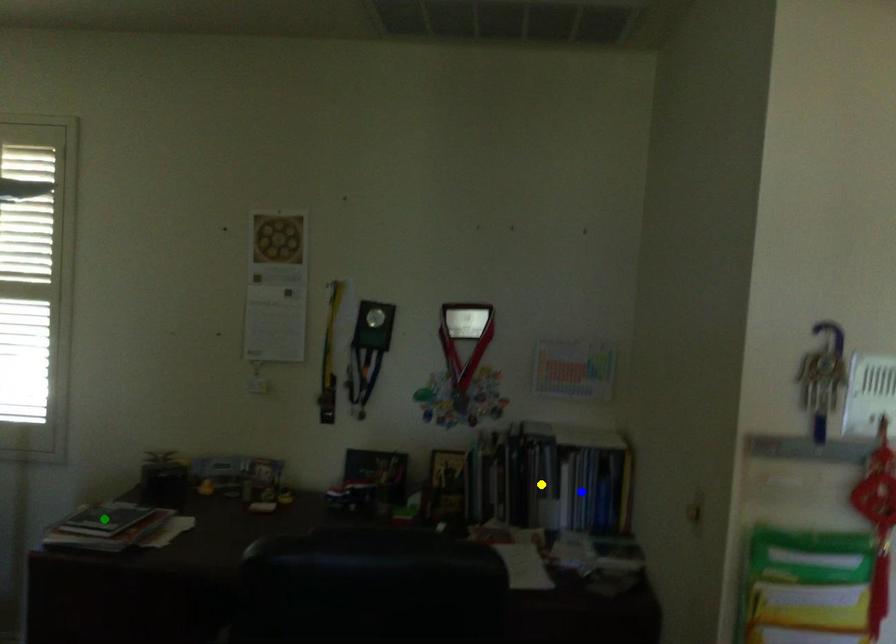
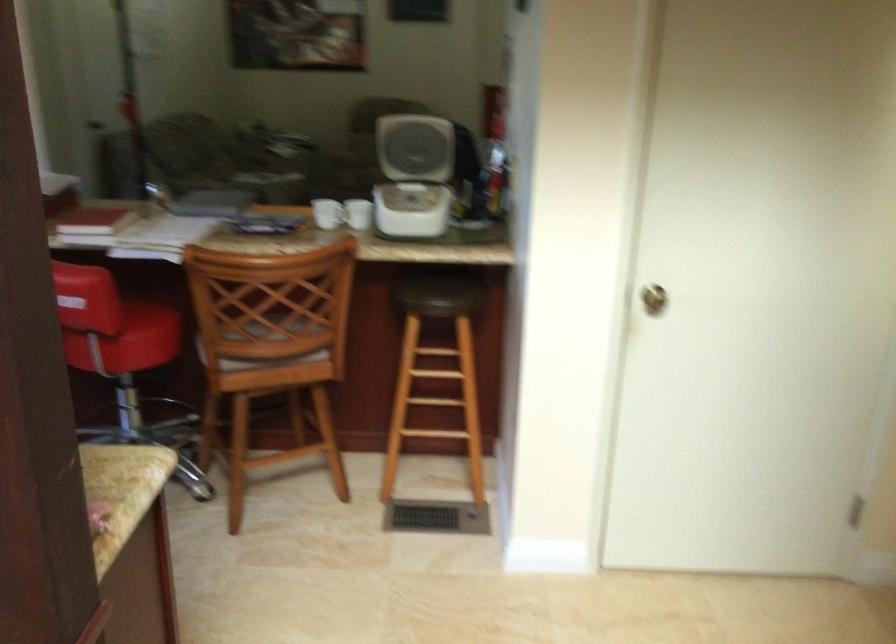
I am providing you with two images of the same scene from different viewpoints. Three points are marked in image1. Which point corresponds to a part or object that is occluded in image2?In image1, three points are marked. Which of them correspond to a part or object that is occluded in image2?Among the three points shown in image1, which one corresponds to a part or object that is no longer visible due to occlusion in image2?

yellow point, green point, blue point cannot be seen in image2.